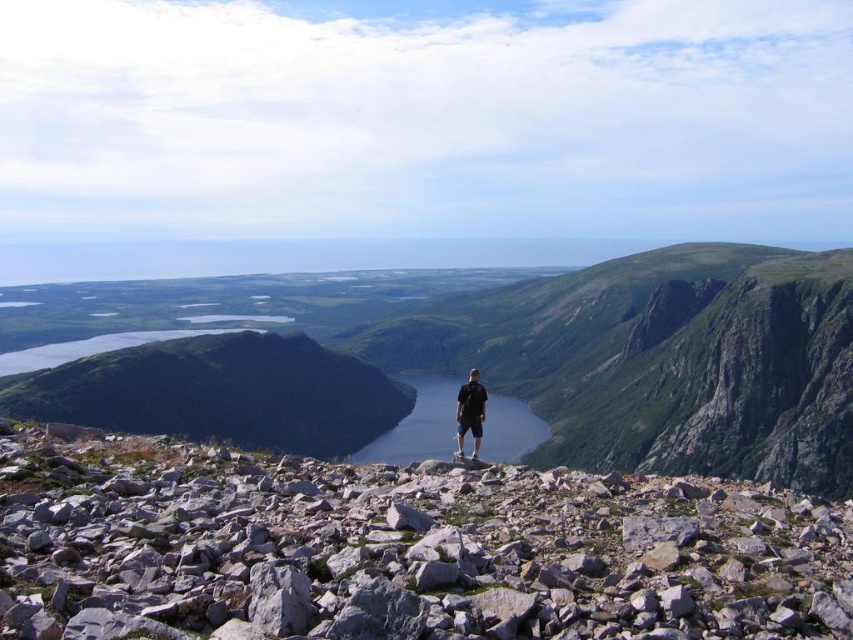
You are a hiker standing on the gray rock at center and want to reach the shiny blue water at center. Which direction should you move to get there?

You should move to the right side since the gray rock at center is positioned on the left side of the shiny blue water at center.

You are a hiker standing on the rocky terrain in the foreground of the image. You see the green grassy mountain at center and the shiny blue water at center. Which object is closer to you?

The green grassy mountain at center is closer to you than the shiny blue water at center.

You are a hiker who wants to cross the valley using the path between the gray rock at center and the shiny blue water at center. Which object will you encounter first if you walk straight ahead?

The gray rock at center will be encountered first because it is closer to the observer than the shiny blue water at center, which is further away.